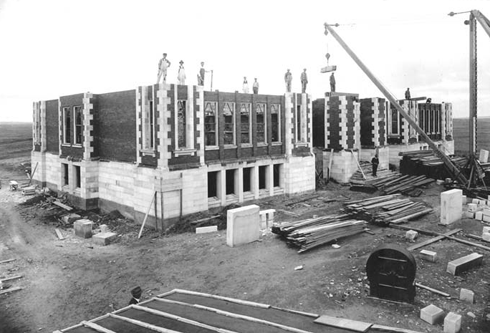
This screenshot has width=490, height=333. What are the coordinates of `wood frame` in the screenshot? It's located at (161, 210).